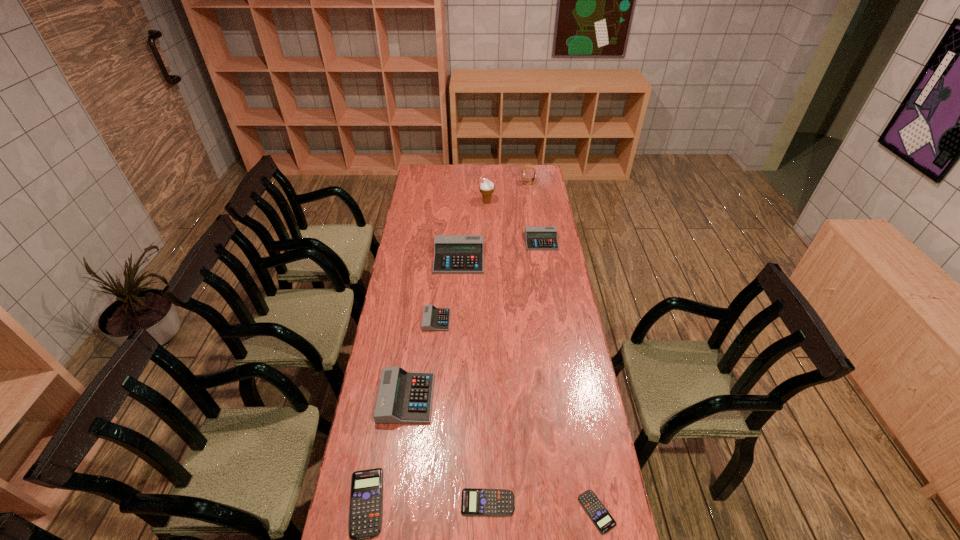
This screenshot has width=960, height=540. Find the location of `vacant space at the left edge`. vacant space at the left edge is located at coordinates (400, 305).

Locate an element on the screen. Image resolution: width=960 pixels, height=540 pixels. vacant space at the right edge of the desktop is located at coordinates (563, 314).

Where is `free region at the far left corner`? Image resolution: width=960 pixels, height=540 pixels. free region at the far left corner is located at coordinates (428, 167).

Identify the location of vacant region at the far right corner of the desktop. This screenshot has height=540, width=960. (542, 170).

The height and width of the screenshot is (540, 960). Find the location of `free space between the fourth tallest object and the fourth tallest calculator`. free space between the fourth tallest object and the fourth tallest calculator is located at coordinates (421, 359).

At what (x,y) coordinates should I click in order to perform the action: click on free space between the second blue calculator from right to left and the fifth shortest object. Please return your answer as a coordinate pair (x, y). The height and width of the screenshot is (540, 960). Looking at the image, I should click on (515, 372).

I want to click on unoccupied position between the fourth shortest calculator and the tallest calculator, so click(x=447, y=289).

Image resolution: width=960 pixels, height=540 pixels. Find the location of `free point between the smallest blue calculator and the third farthest calculator`. free point between the smallest blue calculator and the third farthest calculator is located at coordinates (516, 416).

What are the coordinates of `vacant space that's between the second blue calculator from left to right and the white icecream` in the screenshot? It's located at (488, 352).

You are a GUI agent. You are given a task and a screenshot of the screen. Output one action in this format:
    pyautogui.click(x=<x>, y=<y>)
    Task: Click on the vacant area between the second farthest object and the second shortest calculator
    This screenshot has width=960, height=540.
    Given the screenshot: What is the action you would take?
    pyautogui.click(x=488, y=352)